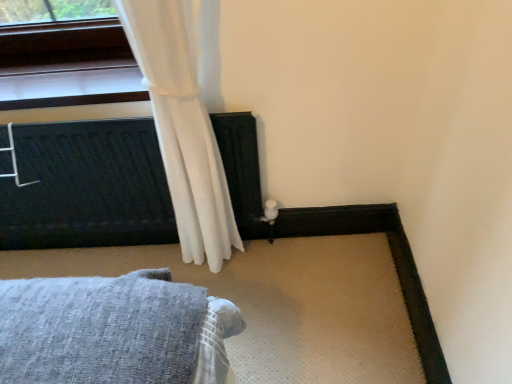
Locate an element on the screen. This screenshot has height=384, width=512. free space below textured gray blanket at lower left (from a real-world perspective) is located at coordinates (140, 253).